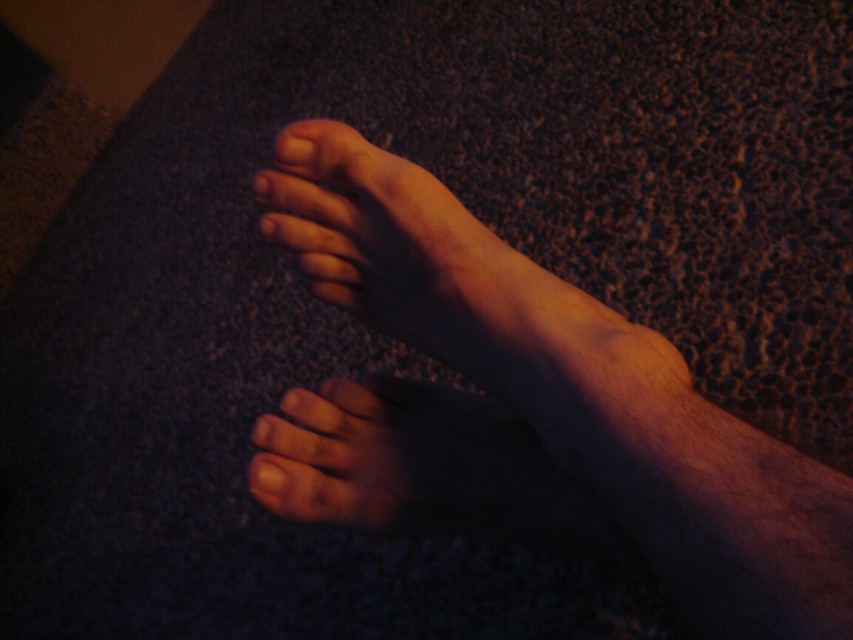
Based on the scene description, which object has a greater height between the dry skin at lower left and the matte skin toe at upper center?

The dry skin at lower left has a greater height compared to the matte skin toe at upper center.

You are a photographer setting up a shoot in a dimly lit room with warm lighting. You need to position a camera to capture both the skinny bare feet at center and the matte skin toe at upper center in the frame. Based on their positions, which object should be placed closer to the camera to ensure both are in focus?

The matte skin toe at upper center should be placed closer to the camera because the skinny bare feet at center is located below it, meaning the toe is nearer to the viewer.

You are a skincare specialist examining a closeup of someone resting their feet on a carpet. You notice the skinny bare feet at center and the dry skin at lower left. Which of these two areas is positioned higher in the image?

The skinny bare feet at center is located above dry skin at lower left, so the skinny bare feet at center is positioned higher in the image.